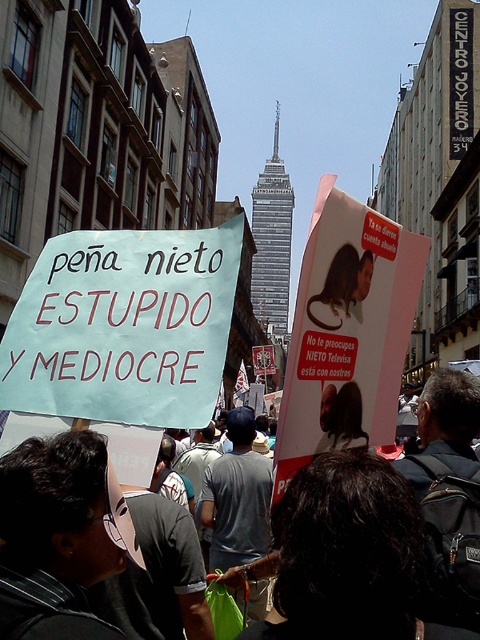
Who is lower down, white paper sign at center or dark gray fabric at center?

Positioned lower is dark gray fabric at center.

Which is in front, point (96, 336) or point (275, 563)?

Point (96, 336) is more forward.

I want to click on white paper sign at center, so click(123, 326).

The height and width of the screenshot is (640, 480). Identify the location of white paper sign at center. (123, 326).